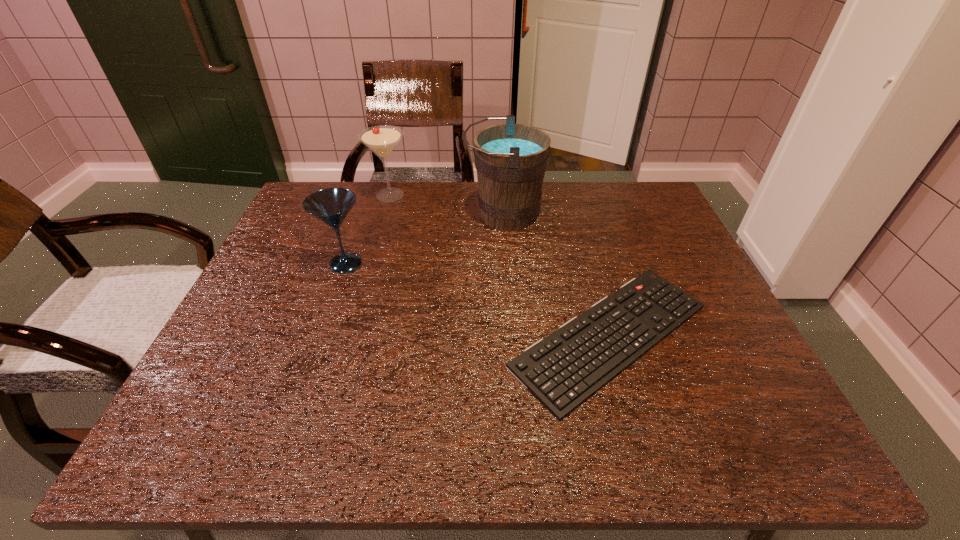
The height and width of the screenshot is (540, 960). Find the location of `wine bucket at the far edge`. wine bucket at the far edge is located at coordinates (511, 159).

Where is `martini at the far edge`? martini at the far edge is located at coordinates (382, 139).

In order to click on object that is positioned at the near edge in this screenshot , I will do `click(563, 370)`.

Where is `object at the left edge`? object at the left edge is located at coordinates (331, 206).

Find the location of a particular element. object that is at the right edge is located at coordinates (563, 370).

Where is `object that is at the near right corner`? object that is at the near right corner is located at coordinates (563, 370).

Find the location of a particular element. This screenshot has height=540, width=960. free spot at the far edge of the desktop is located at coordinates (552, 225).

Find the location of `vacant point at the near edge`. vacant point at the near edge is located at coordinates (466, 423).

At what (x,y) coordinates should I click in order to perform the action: click on free space at the left edge of the desktop. Please return your answer as a coordinate pair (x, y). The width and height of the screenshot is (960, 540). Looking at the image, I should click on (276, 306).

Identify the location of vacant region at the right edge of the desktop. This screenshot has height=540, width=960. (688, 355).